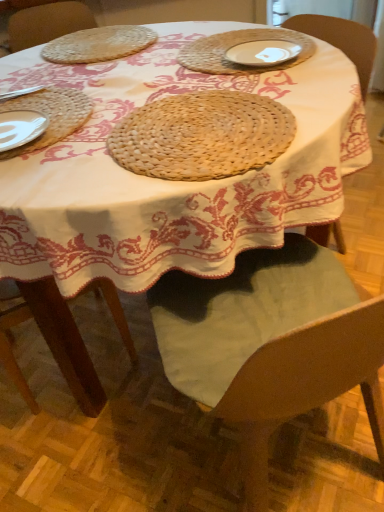
Question: Is woven straw placemat at upper left, acting as the 2th pie starting from the bottom, shorter than white ceramic plate at upper center?

Choices:
 (A) yes
 (B) no

Answer: (B)

Question: Is woven straw placemat at upper left, acting as the 2th pie starting from the bottom, to the left of white ceramic plate at upper center from the viewer's perspective?

Choices:
 (A) no
 (B) yes

Answer: (B)

Question: From the image's perspective, would you say woven straw placemat at upper left, which ranks as the 2th pie in front-to-back order, is positioned over white ceramic plate at upper center?

Choices:
 (A) no
 (B) yes

Answer: (B)

Question: Does woven straw placemat at upper left, acting as the 2th pie starting from the bottom, have a larger size compared to white ceramic plate at upper center?

Choices:
 (A) yes
 (B) no

Answer: (A)

Question: Does woven straw placemat at upper left, acting as the 2th pie starting from the bottom, lie in front of white ceramic plate at upper center?

Choices:
 (A) no
 (B) yes

Answer: (A)

Question: Considering the positions of woven straw placemat at upper left, acting as the 2th pie starting from the bottom, and natural woven placemat at center, placed as the second pie when sorted from top to bottom, in the image, is woven straw placemat at upper left, acting as the 2th pie starting from the bottom, wider or thinner than natural woven placemat at center, placed as the second pie when sorted from top to bottom,?

Choices:
 (A) thin
 (B) wide

Answer: (A)

Question: From the image's perspective, is woven straw placemat at upper left, which ranks as the 2th pie in front-to-back order, above or below natural woven placemat at center, which is the 1th pie from bottom to top?

Choices:
 (A) above
 (B) below

Answer: (A)

Question: From a real-world perspective, is woven straw placemat at upper left, which ranks as the 2th pie in front-to-back order, physically located above or below natural woven placemat at center, placed as the second pie when sorted from top to bottom?

Choices:
 (A) above
 (B) below

Answer: (A)

Question: Relative to natural woven placemat at center, which is the 1th pie from bottom to top, is woven straw placemat at upper left, which ranks as the 2th pie in front-to-back order, in front or behind?

Choices:
 (A) front
 (B) behind

Answer: (B)

Question: Relative to woven straw placemat at left, is natural woven placemat at center, arranged as the second pie when viewed from the back, in front or behind?

Choices:
 (A) behind
 (B) front

Answer: (B)

Question: From the image's perspective, is natural woven placemat at center, arranged as the second pie when viewed from the back, positioned above or below woven straw placemat at left?

Choices:
 (A) above
 (B) below

Answer: (B)

Question: Based on their sizes in the image, would you say natural woven placemat at center, the 1th pie in the front-to-back sequence, is bigger or smaller than woven straw placemat at left?

Choices:
 (A) small
 (B) big

Answer: (B)

Question: From a real-world perspective, is natural woven placemat at center, placed as the second pie when sorted from top to bottom, physically located above or below woven straw placemat at left?

Choices:
 (A) above
 (B) below

Answer: (B)

Question: Considering the positions of woven straw placemat at left and natural woven placemat at center, which is the 1th pie from bottom to top, in the image, is woven straw placemat at left wider or thinner than natural woven placemat at center, which is the 1th pie from bottom to top,?

Choices:
 (A) wide
 (B) thin

Answer: (B)

Question: From a real-world perspective, relative to natural woven placemat at center, placed as the second pie when sorted from top to bottom, is woven straw placemat at left vertically above or below?

Choices:
 (A) below
 (B) above

Answer: (B)